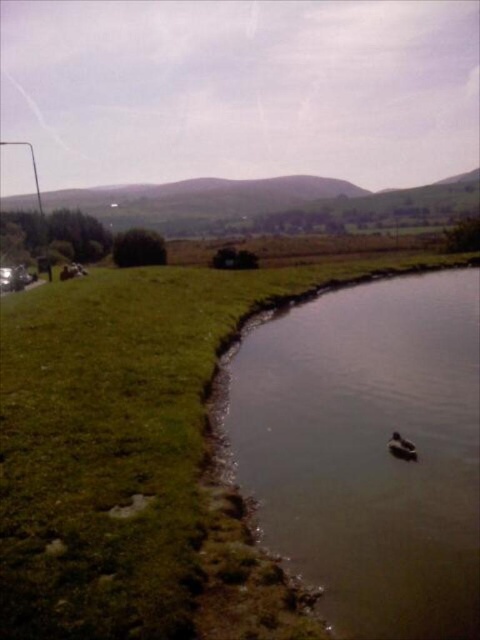
Question: In this image, where is green matte lake at center located relative to brown fuzzy duck at lower right?

Choices:
 (A) left
 (B) right

Answer: (A)

Question: Which of the following is the closest to the observer?

Choices:
 (A) green matte lake at center
 (B) brown fuzzy duck at lower right

Answer: (A)

Question: From the image, what is the correct spatial relationship of green matte lake at center in relation to brown fuzzy duck at lower right?

Choices:
 (A) left
 (B) right

Answer: (A)

Question: Can you confirm if green matte lake at center is thinner than brown fuzzy duck at lower right?

Choices:
 (A) no
 (B) yes

Answer: (A)